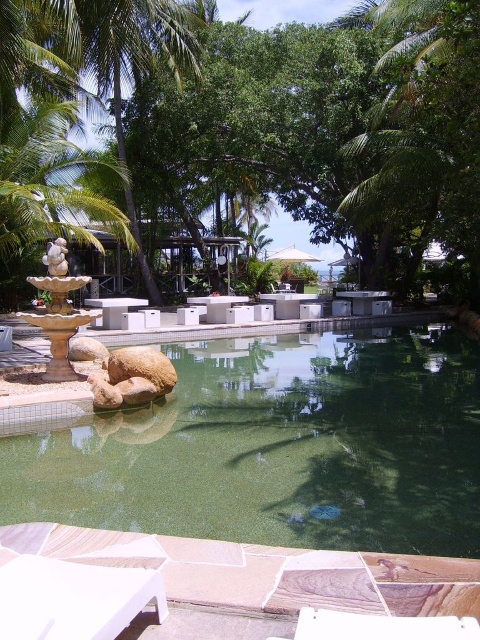
You are standing at the edge of the pool in the tropical setting. There is a point marked at coordinates (325, 134). What object is located at this point?

The point at coordinates (325, 134) corresponds to the green leafy tree at center.